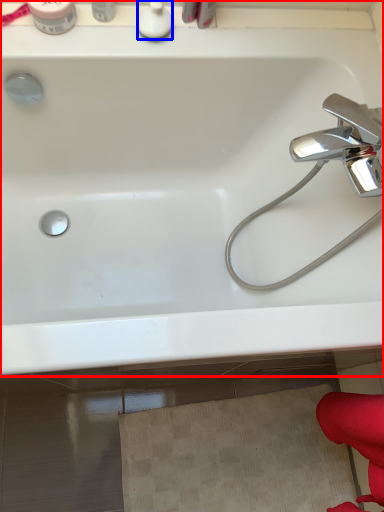
Question: Among these objects, which one is nearest to the camera, bathtub (highlighted by a red box) or toiletry (highlighted by a blue box)?

Choices:
 (A) bathtub
 (B) toiletry

Answer: (A)